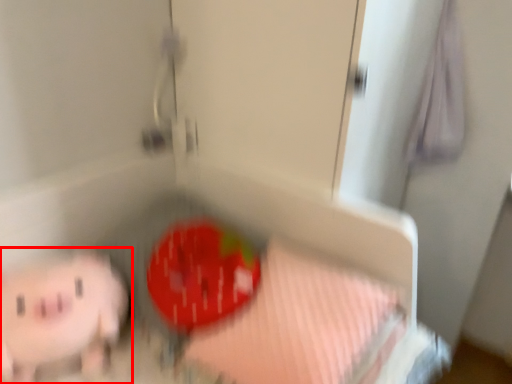
Question: In this image, where is toy (annotated by the red box) located relative to sheet?

Choices:
 (A) right
 (B) left

Answer: (B)